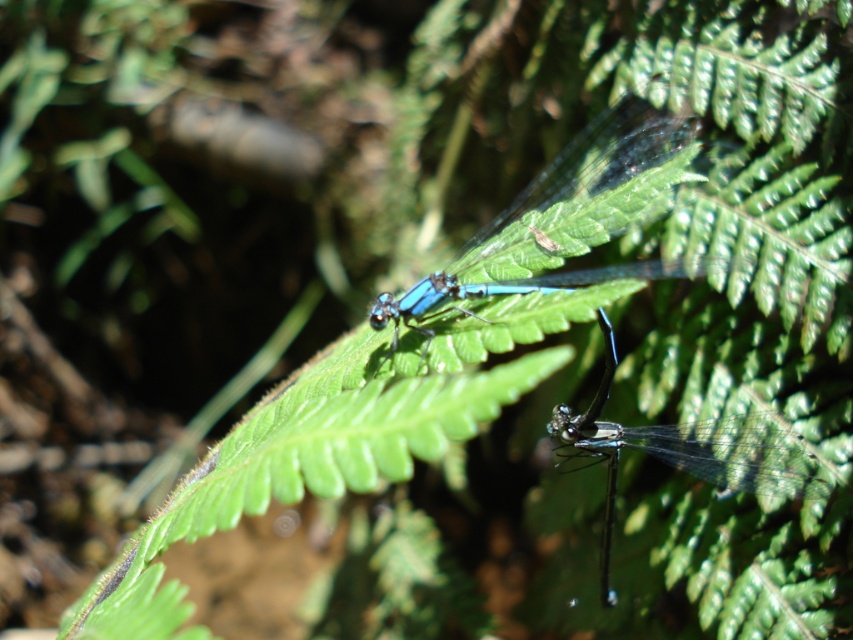
You are a nature photographer trying to capture both the blue translucent dragonfly at center and the transparent glass dragonfly at center in a single shot. Since you want them both to be in focus, you need to know which one is closer to the camera. Can you determine which dragonfly is closer based on their positions?

The blue translucent dragonfly at center is to the left of the transparent glass dragonfly at center, but their distance from the camera cannot be determined based on their horizontal positions alone. You may need to adjust your focus or use a smaller aperture to ensure both are in focus.

You are a photographer aiming to capture a closeup of the blue translucent dragonfly at center. The camera is currently focused at point (547,212). Is the camera focused on the dragonfly?

Yes, the camera is focused on the blue translucent dragonfly at center because the description states that at point (547,212) lies the dragonfly.

You are an entomologist examining two dragonflies on a fern leaf. You notice that one is a real blue translucent dragonfly at center and the other is a transparent glass dragonfly at center. Which dragonfly is closer to your eyes?

The blue translucent dragonfly at center is closer to your eyes because it is positioned further to the viewer than the transparent glass dragonfly at center.